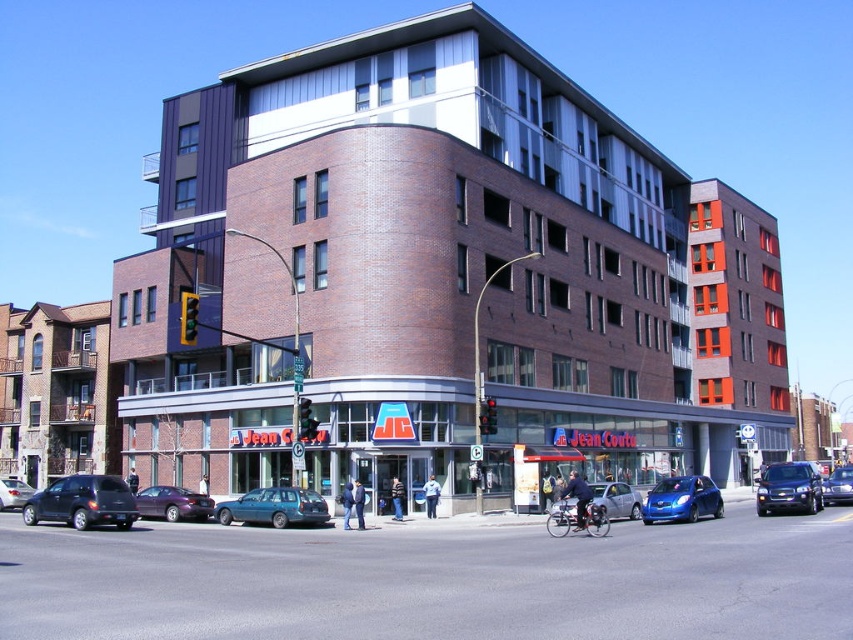
Question: Which of the following is the farthest from the observer?

Choices:
 (A) shiny silver sedan at center
 (B) metallic silver sedan at center

Answer: (A)

Question: Which object is positioned closest to the matte black sedan at center?

Choices:
 (A) matte black suv at lower left
 (B) metallic blue suv at center
 (C) shiny blue sedan at center

Answer: (A)

Question: Does matte black suv at lower left appear over metallic silver sedan at center?

Choices:
 (A) no
 (B) yes

Answer: (B)

Question: Is shiny blue sedan at center in front of metallic silver sedan at center?

Choices:
 (A) no
 (B) yes

Answer: (A)

Question: Among these points, which one is nearest to the camera?

Choices:
 (A) (202, 497)
 (B) (7, 484)

Answer: (A)

Question: Can you confirm if metallic silver car at center is bigger than teal matte station wagon at center?

Choices:
 (A) no
 (B) yes

Answer: (B)